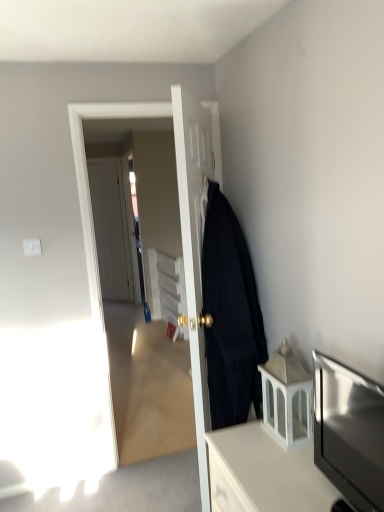
Question: From a real-world perspective, is transparent glass door at center positioned above or below white matte door at center, which is counted as the first door, starting from the left?

Choices:
 (A) below
 (B) above

Answer: (A)

Question: Is transparent glass door at center in front of or behind white matte door at center, which is the 2th door in front-to-back order, in the image?

Choices:
 (A) front
 (B) behind

Answer: (A)

Question: Which object is positioned closest to the white glossy cabinet at lower right, marked as the second cabinetry in a top-to-bottom arrangement?

Choices:
 (A) black woolen coat at right
 (B) matte black tv at lower right
 (C) white glass lantern at lower right, which is the second cabinetry from bottom to top
 (D) transparent glass door at center
 (E) white matte door at center, which is the 2th door in front-to-back order

Answer: (C)

Question: Which of these objects is positioned farthest from the white glossy cabinet at lower right, which is the first cabinetry in bottom-to-top order?

Choices:
 (A) black woolen coat at right
 (B) transparent glass door at center
 (C) matte black tv at lower right
 (D) white matte door at center, positioned as the first door in back-to-front order
 (E) matte black coat at center, acting as the 1th door starting from the right

Answer: (D)